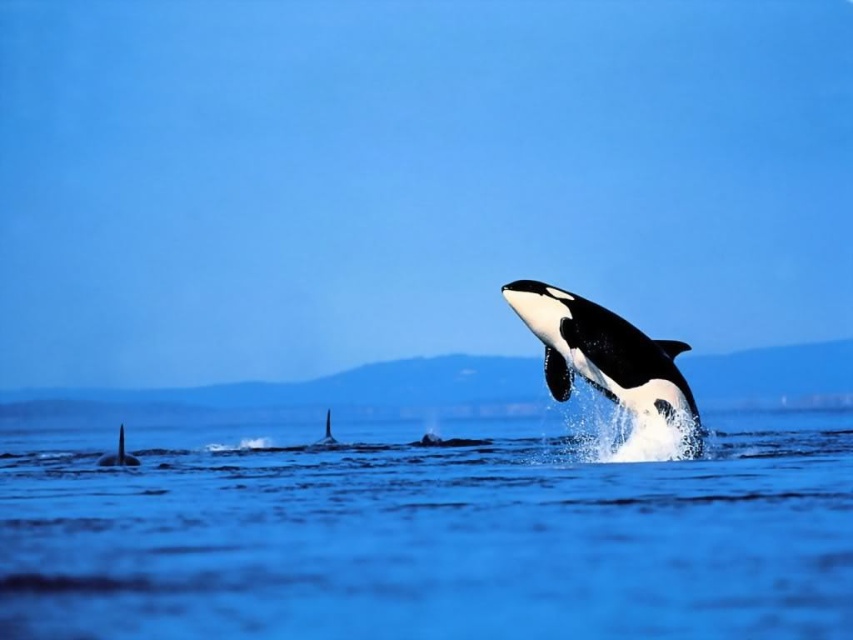
Question: Which point is farther to the camera?

Choices:
 (A) blue water at center
 (B) black/white whale at center

Answer: (B)

Question: Estimate the real-world distances between objects in this image. Which object is closer to the blue water at center?

Choices:
 (A) black smooth whale at center
 (B) black/white whale at center
 (C) black smooth fin at left

Answer: (B)

Question: Does blue water at center appear under black smooth whale at center?

Choices:
 (A) no
 (B) yes

Answer: (A)

Question: From the image, what is the correct spatial relationship of black/white whale at center in relation to black smooth whale at center?

Choices:
 (A) below
 (B) above

Answer: (B)

Question: Is black smooth fin at left below black smooth whale at center?

Choices:
 (A) yes
 (B) no

Answer: (A)

Question: Which point appears farthest from the camera in this image?

Choices:
 (A) (97, 464)
 (B) (259, 618)
 (C) (332, 440)

Answer: (C)